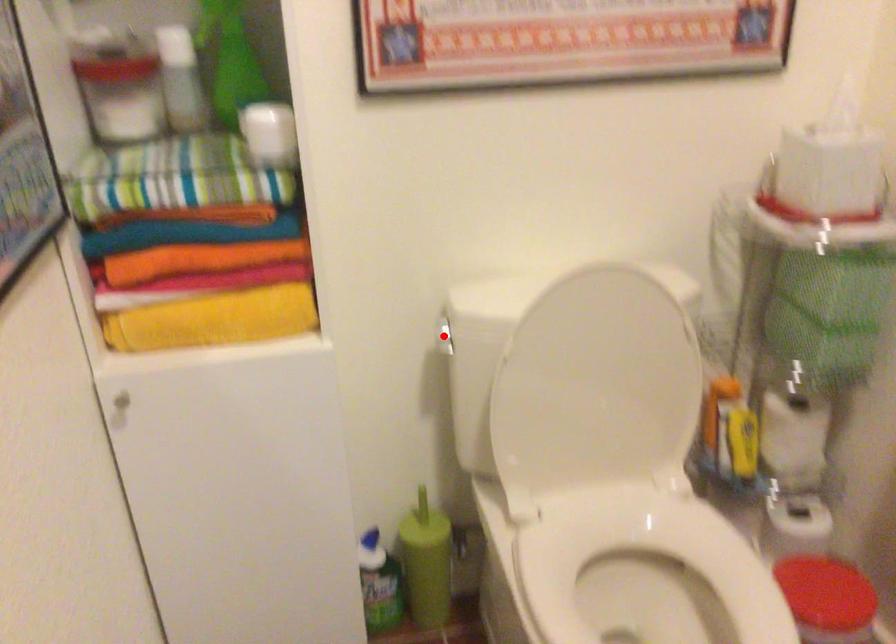
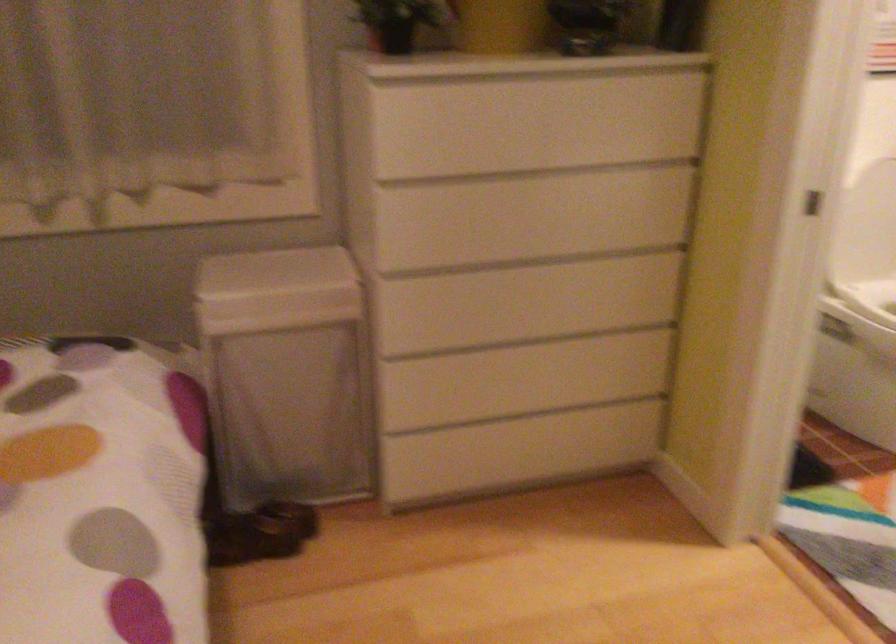
Question: I am providing you with two images of the same scene from different viewpoints. A red point is marked on the first image. Can you still see the location of the red point in image 2?

Choices:
 (A) Yes
 (B) No

Answer: (B)